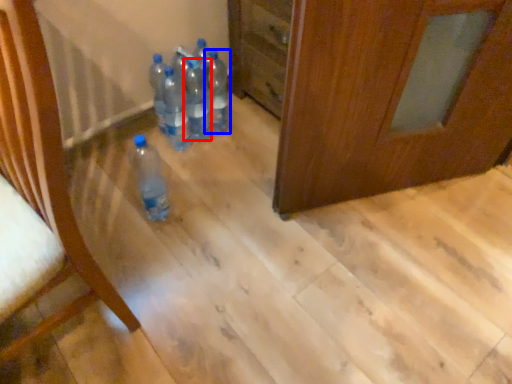
Question: Which object is further to the camera taking this photo, bottle (highlighted by a red box) or bottle (highlighted by a blue box)?

Choices:
 (A) bottle
 (B) bottle

Answer: (B)